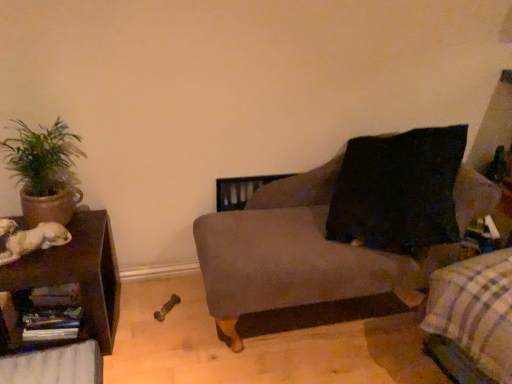
At what (x,y) coordinates should I click in order to perform the action: click on unoccupied region to the right of brown wood table at left. Please return your answer as a coordinate pair (x, y). Looking at the image, I should click on (157, 326).